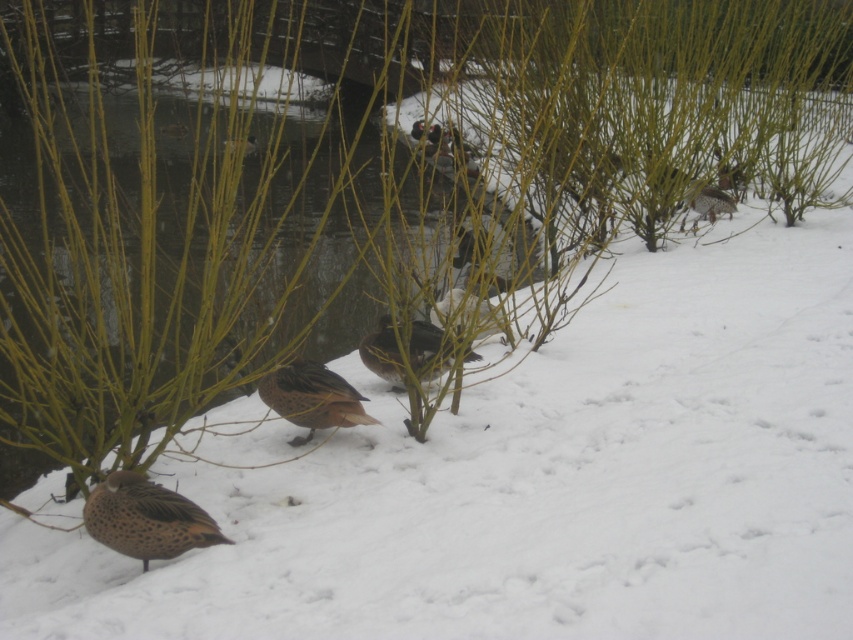
Question: Considering the relative positions of speckled brown duck at lower left and brown speckled duck at center in the image provided, where is speckled brown duck at lower left located with respect to brown speckled duck at center?

Choices:
 (A) below
 (B) above

Answer: (A)

Question: Which object is positioned farthest from the brown speckled feathers at center?

Choices:
 (A) speckled brown duck at lower left
 (B) brown speckled duck at center

Answer: (A)

Question: Is speckled brown duck at lower left positioned in front of brown speckled feathers at center?

Choices:
 (A) yes
 (B) no

Answer: (A)

Question: Is speckled brown duck at lower left closer to the viewer compared to brown speckled duck at center?

Choices:
 (A) yes
 (B) no

Answer: (A)

Question: Estimate the real-world distances between objects in this image. Which object is closer to the brown speckled duck at center?

Choices:
 (A) speckled brown duck at lower left
 (B) brown speckled feathers at center

Answer: (B)

Question: Which object is positioned farthest from the brown speckled duck at center?

Choices:
 (A) speckled brown duck at lower left
 (B) brown speckled feathers at center

Answer: (A)